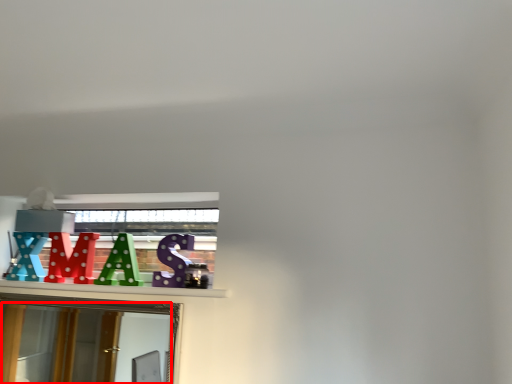
Question: From the image's perspective, where is mirror (annotated by the red box) located relative to alphabet?

Choices:
 (A) above
 (B) below

Answer: (B)